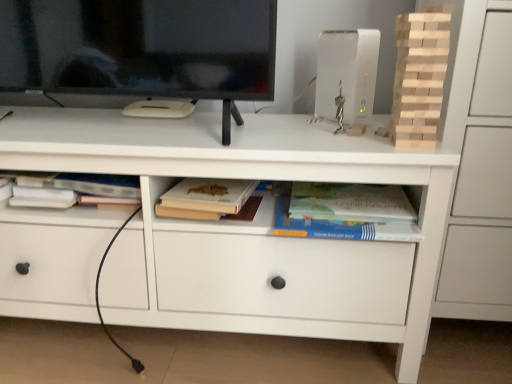
Where is `free space in front of white plastic router at upper right`? The width and height of the screenshot is (512, 384). free space in front of white plastic router at upper right is located at coordinates (342, 138).